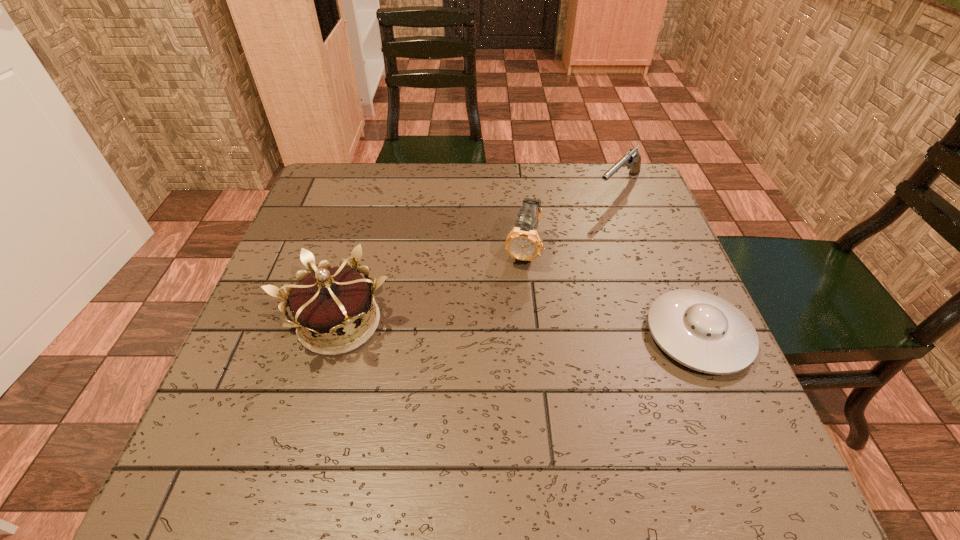
At what (x,y) coordinates should I click in order to perform the action: click on free spot located on the face of the third object from right to left. Please return your answer as a coordinate pair (x, y). This screenshot has height=540, width=960. Looking at the image, I should click on (488, 401).

The image size is (960, 540). Find the location of `blank area located aiming along the barrel of the farthest object`. blank area located aiming along the barrel of the farthest object is located at coordinates (554, 255).

This screenshot has height=540, width=960. Identify the location of free space located aiming along the barrel of the farthest object. (596, 213).

This screenshot has height=540, width=960. I want to click on vacant space situated aiming along the barrel of the farthest object, so click(521, 288).

The width and height of the screenshot is (960, 540). Find the location of `object present at the far edge`. object present at the far edge is located at coordinates (632, 158).

Identify the location of object at the near edge. This screenshot has width=960, height=540. 701,331.

I want to click on object that is positioned at the left edge, so click(x=330, y=303).

Locate an element on the screen. This screenshot has width=960, height=540. saucer present at the right edge is located at coordinates (701, 331).

Image resolution: width=960 pixels, height=540 pixels. In order to click on gun at the right edge in this screenshot , I will do `click(632, 158)`.

Where is `object at the far right corner`? The image size is (960, 540). object at the far right corner is located at coordinates (632, 158).